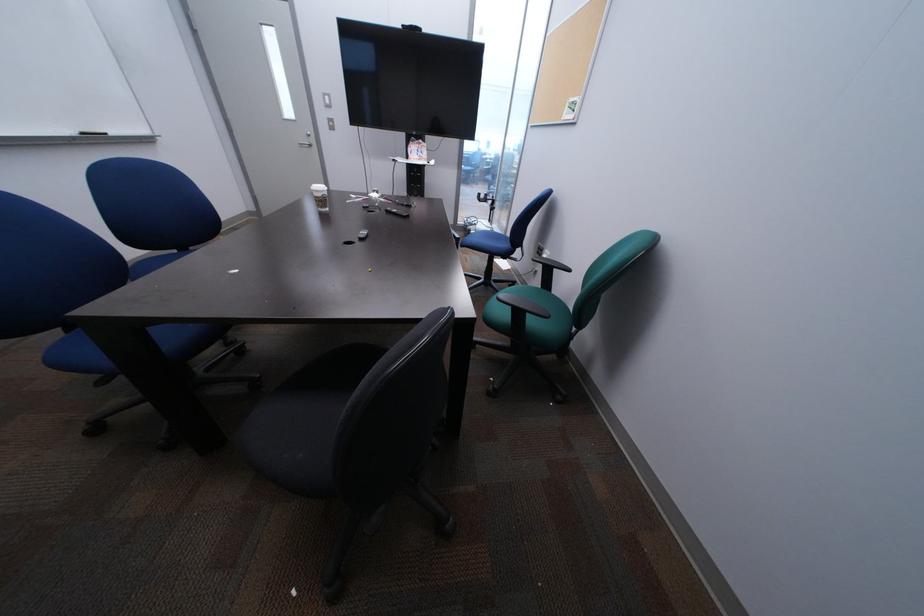
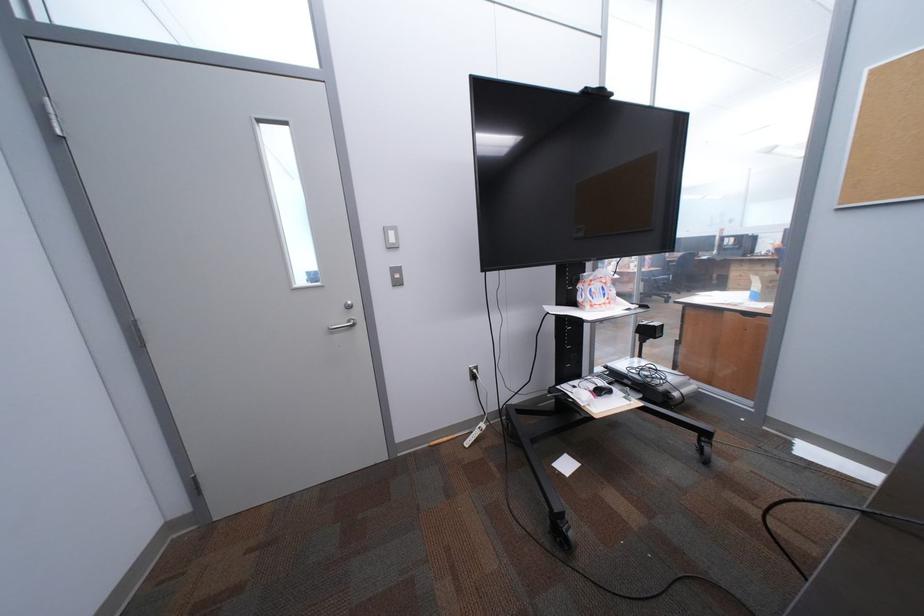
What movement of the cameraman would produce the second image?

The movement direction of the cameraman is left, forward.